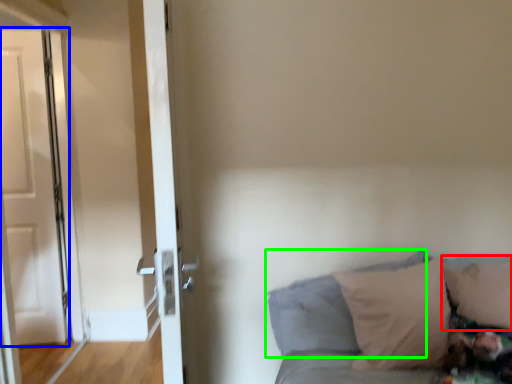
Question: Which is farther away from pillow (highlighted by a red box)? door (highlighted by a blue box) or pillow (highlighted by a green box)?

Choices:
 (A) door
 (B) pillow

Answer: (A)